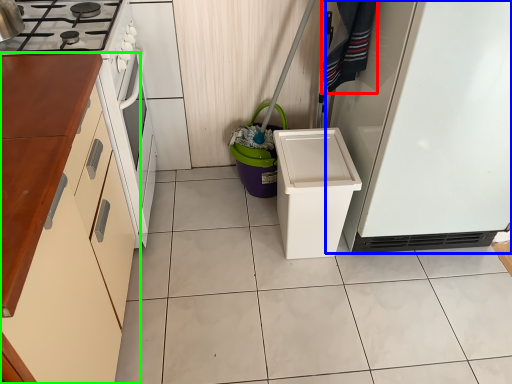
Question: Which object is positioned farthest from laundry (highlighted by a red box)? Select from refrigerator (highlighted by a blue box) and cabinetry (highlighted by a green box).

Choices:
 (A) refrigerator
 (B) cabinetry

Answer: (B)